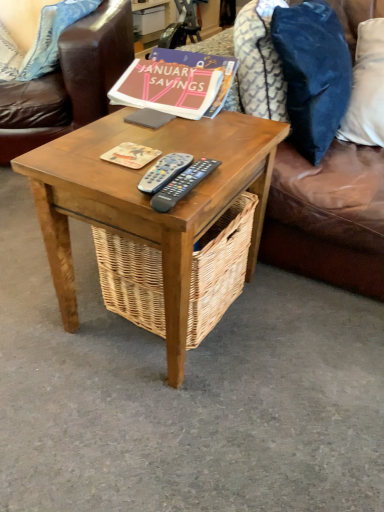
The image size is (384, 512). Identify the location of free spot in front of wooden side table at center. (172, 425).